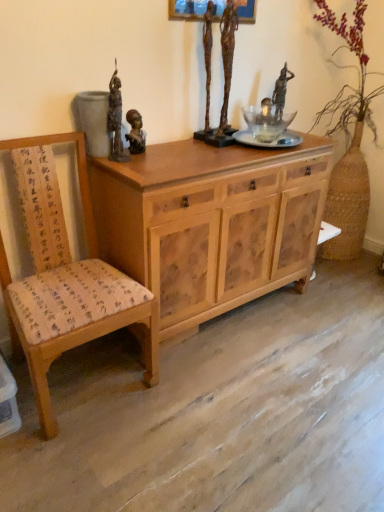
Question: Is bronze statue at upper left, which is the first sculpture from left to right, closer to camera compared to wooden chair with fabric cushion at left?

Choices:
 (A) yes
 (B) no

Answer: (B)

Question: From the image's perspective, is bronze statue at upper left, which is the first sculpture from left to right, on wooden chair with fabric cushion at left?

Choices:
 (A) yes
 (B) no

Answer: (A)

Question: Is bronze statue at upper left, which is the first sculpture from left to right, touching wooden chair with fabric cushion at left?

Choices:
 (A) no
 (B) yes

Answer: (A)

Question: Is bronze statue at upper left, which is the first sculpture from left to right, shorter than wooden chair with fabric cushion at left?

Choices:
 (A) no
 (B) yes

Answer: (B)

Question: Can you confirm if bronze statue at upper left, which is the first sculpture from left to right, is thinner than wooden chair with fabric cushion at left?

Choices:
 (A) no
 (B) yes

Answer: (B)

Question: From the image's perspective, is bronze statue at upper left, which ranks as the 2th sculpture in right-to-left order, below wooden chair with fabric cushion at left?

Choices:
 (A) yes
 (B) no

Answer: (B)

Question: Considering the relative positions of bronze statue at center, the first person in the left-to-right sequence, and bronze statue at upper left, which is the first sculpture from left to right, in the image provided, is bronze statue at center, the first person in the left-to-right sequence, in front of bronze statue at upper left, which is the first sculpture from left to right,?

Choices:
 (A) yes
 (B) no

Answer: (B)

Question: Can we say bronze statue at center, which ranks as the third person in right-to-left order, lies outside bronze statue at upper left, which ranks as the 2th sculpture in right-to-left order?

Choices:
 (A) no
 (B) yes

Answer: (B)

Question: Is bronze statue at upper left, which is the first sculpture from left to right, inside bronze statue at center, which ranks as the third person in right-to-left order?

Choices:
 (A) yes
 (B) no

Answer: (B)

Question: Considering the relative sizes of bronze statue at center, the first person in the left-to-right sequence, and bronze statue at upper left, which ranks as the 2th sculpture in right-to-left order, in the image provided, is bronze statue at center, the first person in the left-to-right sequence, smaller than bronze statue at upper left, which ranks as the 2th sculpture in right-to-left order,?

Choices:
 (A) yes
 (B) no

Answer: (A)

Question: Is bronze statue at center, which ranks as the third person in right-to-left order, aimed at bronze statue at upper left, which ranks as the 2th sculpture in right-to-left order?

Choices:
 (A) no
 (B) yes

Answer: (A)

Question: From the image's perspective, is bronze statue at center, which ranks as the third person in right-to-left order, over bronze statue at upper left, which ranks as the 2th sculpture in right-to-left order?

Choices:
 (A) yes
 (B) no

Answer: (B)

Question: From the image's perspective, is bronze statue at center, which ranks as the 1th sculpture in right-to-left order, under transparent glass vase at upper center, which appears as the 2th person when viewed from the right?

Choices:
 (A) no
 (B) yes

Answer: (A)